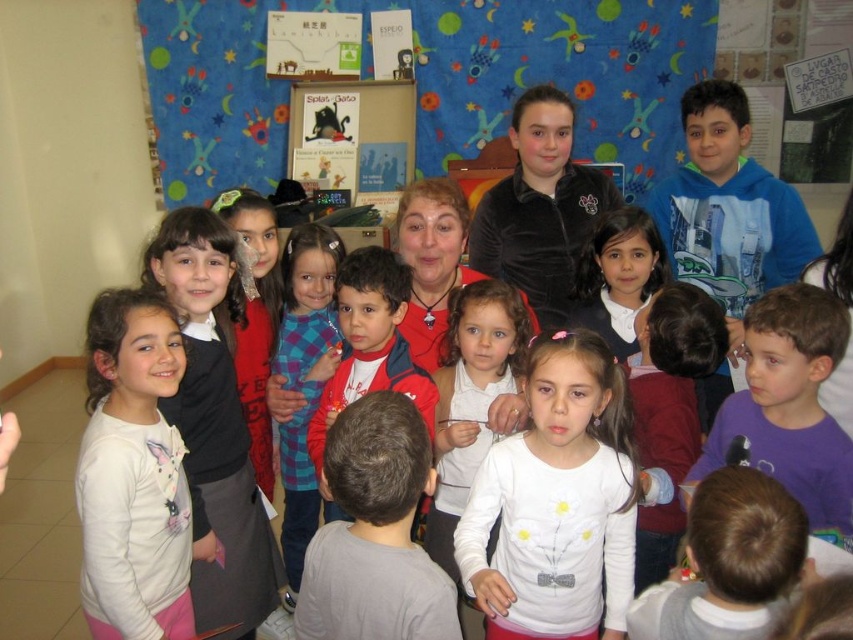
Question: Which object is the farthest from the red fleece jacket at center?

Choices:
 (A) white soft shirt at left
 (B) matte cardboard bookshelf at upper center

Answer: (B)

Question: Among these objects, which one is farthest from the camera?

Choices:
 (A) gray cotton shirt at center
 (B) white matte shirt at center

Answer: (B)

Question: Is white matte shirt at center to the right of matte cardboard bookshelf at upper center from the viewer's perspective?

Choices:
 (A) no
 (B) yes

Answer: (B)

Question: Observing the image, what is the correct spatial positioning of matte cardboard bookshelf at upper center in reference to matte red sweater at center?

Choices:
 (A) below
 (B) above

Answer: (B)

Question: Among these points, which one is nearest to the camera?

Choices:
 (A) (340, 170)
 (B) (514, 474)
 (C) (294, 294)
 (D) (421, 348)

Answer: (B)

Question: Is gray cotton shirt at center smaller than red fleece jacket at center?

Choices:
 (A) no
 (B) yes

Answer: (B)